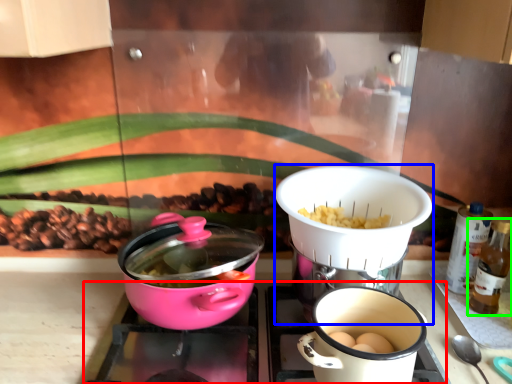
Question: Estimate the real-world distances between objects in this image. Which object is closer to gas stove (highlighted by a red box), kitchen appliance (highlighted by a blue box) or bottle (highlighted by a green box)?

Choices:
 (A) kitchen appliance
 (B) bottle

Answer: (A)